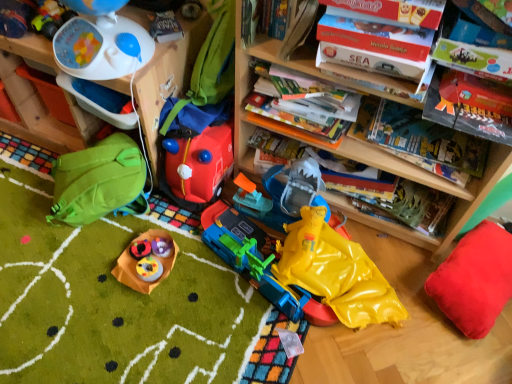
Question: Is the position of wooden bookcase at upper center more distant than that of matte plastic cupcakes at center, which appears as the 5th toy when viewed from the left?

Choices:
 (A) no
 (B) yes

Answer: (A)

Question: Does wooden bookcase at upper center appear on the right side of matte plastic cupcakes at center, which appears as the 5th toy when viewed from the left?

Choices:
 (A) yes
 (B) no

Answer: (A)

Question: From a real-world perspective, is wooden bookcase at upper center physically below matte plastic cupcakes at center, which ranks as the third toy in right-to-left order?

Choices:
 (A) no
 (B) yes

Answer: (A)

Question: Considering the relative sizes of wooden bookcase at upper center and matte plastic cupcakes at center, which ranks as the third toy in right-to-left order, in the image provided, is wooden bookcase at upper center taller than matte plastic cupcakes at center, which ranks as the third toy in right-to-left order,?

Choices:
 (A) no
 (B) yes

Answer: (B)

Question: Are wooden bookcase at upper center and matte plastic cupcakes at center, which appears as the 5th toy when viewed from the left, located far from each other?

Choices:
 (A) yes
 (B) no

Answer: (B)

Question: Considering the positions of rubberized plastic toy at center, the 5th toy from the right, and wooden bookcase at upper center in the image, is rubberized plastic toy at center, the 5th toy from the right, taller or shorter than wooden bookcase at upper center?

Choices:
 (A) tall
 (B) short

Answer: (B)

Question: Is rubberized plastic toy at center, the 3th toy when ordered from left to right, inside or outside of wooden bookcase at upper center?

Choices:
 (A) outside
 (B) inside

Answer: (A)

Question: Would you say rubberized plastic toy at center, the 3th toy when ordered from left to right, is to the left or to the right of wooden bookcase at upper center in the picture?

Choices:
 (A) right
 (B) left

Answer: (B)

Question: Looking at their shapes, would you say rubberized plastic toy at center, the 3th toy when ordered from left to right, is wider or thinner than wooden bookcase at upper center?

Choices:
 (A) thin
 (B) wide

Answer: (A)

Question: Relative to black cardboard book at upper right, marked as the fourth book in a back-to-front arrangement, is hardcover book at upper center, which is the 5th book in front-to-back order, in front or behind?

Choices:
 (A) behind
 (B) front

Answer: (A)

Question: From a real-world perspective, is hardcover book at upper center, which is the 2th book from back to front, positioned above or below black cardboard book at upper right, marked as the fourth book in a back-to-front arrangement?

Choices:
 (A) above
 (B) below

Answer: (B)

Question: Considering the relative positions of hardcover book at upper center, which is the 2th book from back to front, and black cardboard book at upper right, the 3th book in the front-to-back sequence, in the image provided, is hardcover book at upper center, which is the 2th book from back to front, to the left or to the right of black cardboard book at upper right, the 3th book in the front-to-back sequence,?

Choices:
 (A) right
 (B) left

Answer: (B)

Question: Would you say hardcover book at upper center, which is the 5th book in front-to-back order, is inside or outside black cardboard book at upper right, the 3th book in the front-to-back sequence?

Choices:
 (A) outside
 (B) inside

Answer: (A)

Question: In terms of height, does white plastic toy at upper left, the 2th toy viewed from the left, look taller or shorter compared to rubberized plastic toy at center, the 5th toy from the right?

Choices:
 (A) tall
 (B) short

Answer: (A)

Question: Is white plastic toy at upper left, the 2th toy viewed from the left, to the left or to the right of rubberized plastic toy at center, the 3th toy when ordered from left to right, in the image?

Choices:
 (A) right
 (B) left

Answer: (B)